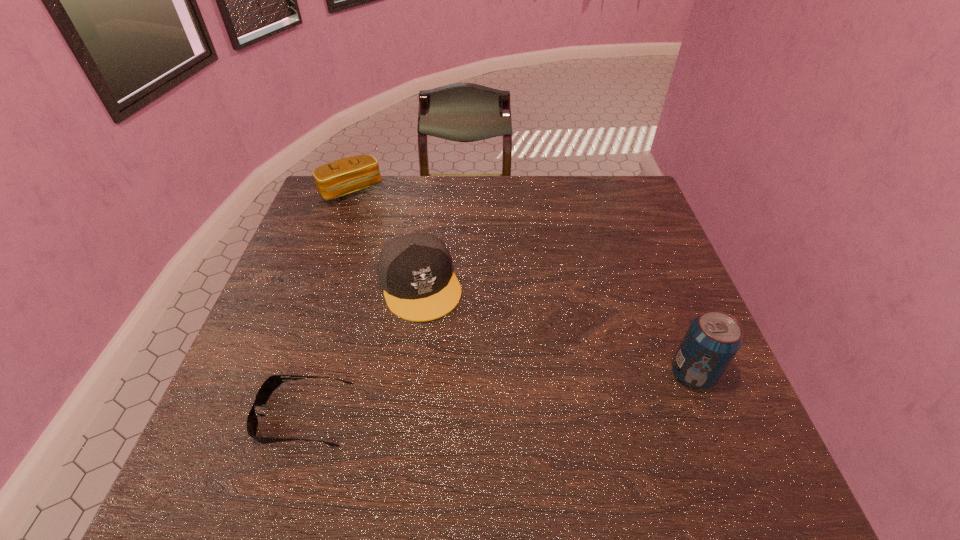
At what (x,y) coordinates should I click in order to perform the action: click on object positioned at the near left corner. Please return your answer as a coordinate pair (x, y). Looking at the image, I should click on (267, 388).

Image resolution: width=960 pixels, height=540 pixels. Identify the location of object that is at the near right corner. (712, 340).

At what (x,y) coordinates should I click in order to perform the action: click on vacant space at the far edge of the desktop. Please return your answer as a coordinate pair (x, y). The height and width of the screenshot is (540, 960). Looking at the image, I should click on (410, 190).

You are a GUI agent. You are given a task and a screenshot of the screen. Output one action in this format:
    pyautogui.click(x=<x>, y=<y>)
    Task: Click on the free point at the near edge
    
    Given the screenshot: What is the action you would take?
    pyautogui.click(x=550, y=401)

At what (x,y) coordinates should I click in order to perform the action: click on free region at the left edge of the desktop. Please return your answer as a coordinate pair (x, y). This screenshot has width=960, height=540. Looking at the image, I should click on (300, 351).

In the image, there is a desktop. At what (x,y) coordinates should I click in order to perform the action: click on vacant space at the right edge. Please return your answer as a coordinate pair (x, y). The height and width of the screenshot is (540, 960). Looking at the image, I should click on (650, 278).

At what (x,y) coordinates should I click in order to perform the action: click on vacant area at the far left corner. Please return your answer as a coordinate pair (x, y). Looking at the image, I should click on (346, 219).

The width and height of the screenshot is (960, 540). In the image, there is a desktop. What are the coordinates of `vacant region at the far right corner` in the screenshot? It's located at (593, 185).

Where is `free point between the second farthest object and the tallest object`? Image resolution: width=960 pixels, height=540 pixels. free point between the second farthest object and the tallest object is located at coordinates (556, 329).

This screenshot has height=540, width=960. What are the coordinates of `empty space that is in between the third nearest object and the farthest object` in the screenshot? It's located at (385, 238).